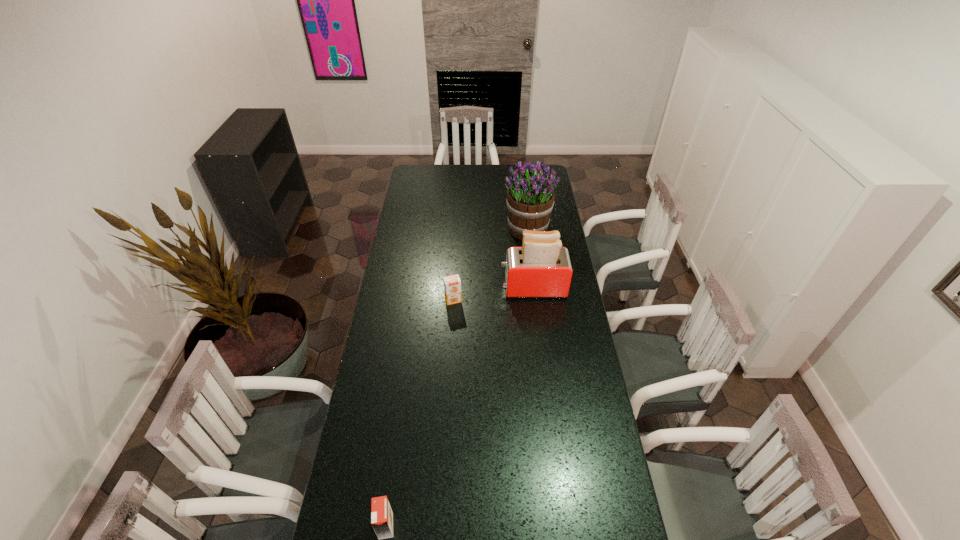
Find the location of a particular element. The height and width of the screenshot is (540, 960). free region located 0.140m on the front-facing side of the toaster is located at coordinates (469, 288).

Where is `vacant space located on the left of the third object from right to left`? vacant space located on the left of the third object from right to left is located at coordinates (393, 300).

At what (x,y) coordinates should I click in order to perform the action: click on vacant space located on the back of the nearest object. Please return your answer as a coordinate pair (x, y). This screenshot has width=960, height=540. Looking at the image, I should click on (397, 444).

Where is `object located at the left edge`? object located at the left edge is located at coordinates (381, 513).

Locate an element on the screen. Image resolution: width=960 pixels, height=540 pixels. bouquet that is at the right edge is located at coordinates (530, 197).

I want to click on toaster situated at the right edge, so click(541, 268).

Locate an element on the screen. The width and height of the screenshot is (960, 540). vacant space at the far edge of the desktop is located at coordinates (487, 173).

At what (x,y) coordinates should I click in order to perform the action: click on free space at the left edge. Please return your answer as a coordinate pair (x, y). The height and width of the screenshot is (540, 960). Looking at the image, I should click on (391, 352).

In the image, there is a desktop. Where is `vacant space at the right edge`? vacant space at the right edge is located at coordinates (577, 433).

Locate an element on the screen. This screenshot has height=540, width=960. free space between the bouquet and the right orange juice is located at coordinates (491, 264).